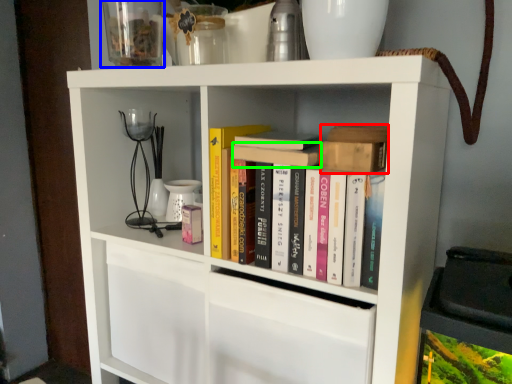
Question: Based on their relative distances, which object is farther from book (highlighted by a red box)? Choose from glass vase (highlighted by a blue box) and book (highlighted by a green box).

Choices:
 (A) glass vase
 (B) book

Answer: (A)